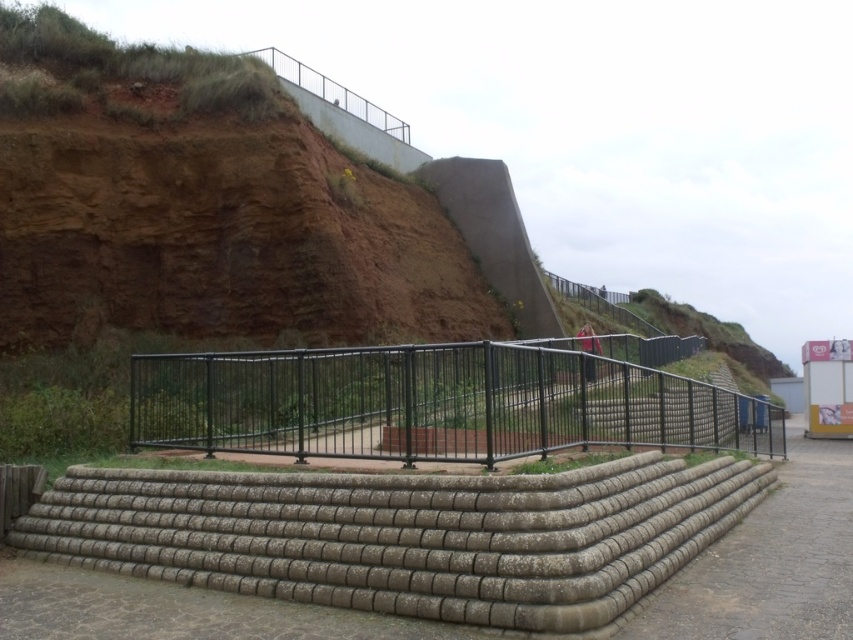
Question: Which point is farther to the camera?

Choices:
 (A) [x=627, y=381]
 (B) [x=383, y=608]

Answer: (A)

Question: Does concrete textured stairs at center appear on the left side of black metal fence at center?

Choices:
 (A) no
 (B) yes

Answer: (B)

Question: Among these objects, which one is farthest from the camera?

Choices:
 (A) concrete textured stairs at center
 (B) black metal fence at center

Answer: (B)

Question: Is concrete textured stairs at center to the left of black metal fence at center from the viewer's perspective?

Choices:
 (A) no
 (B) yes

Answer: (B)

Question: Is concrete textured stairs at center further to camera compared to black metal fence at center?

Choices:
 (A) yes
 (B) no

Answer: (B)

Question: Among these objects, which one is nearest to the camera?

Choices:
 (A) black metal fence at center
 (B) concrete textured stairs at center

Answer: (B)